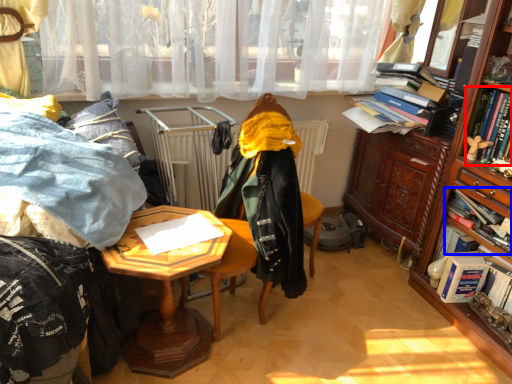
Question: Which object appears closest to the camera in this image, book (highlighted by a red box) or book (highlighted by a blue box)?

Choices:
 (A) book
 (B) book

Answer: (A)